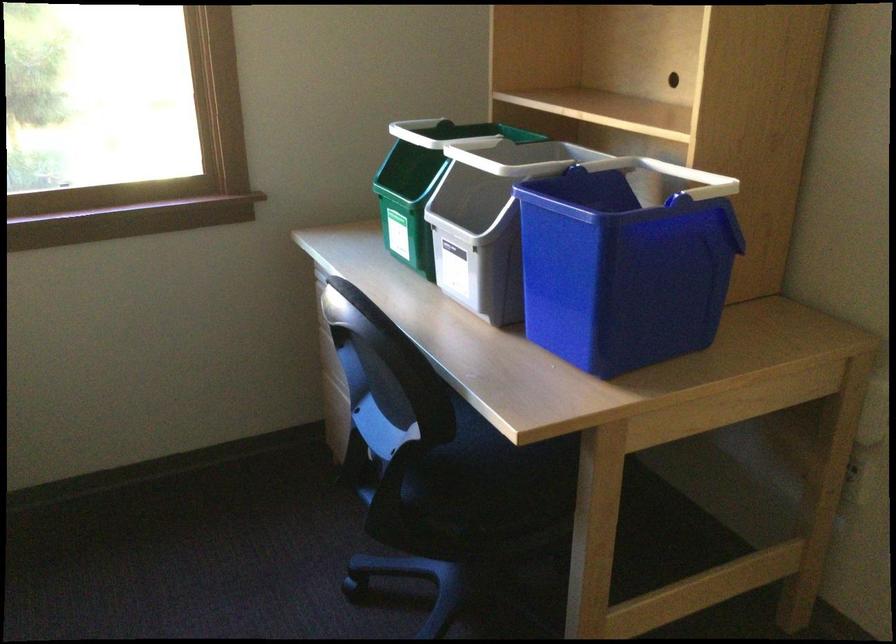
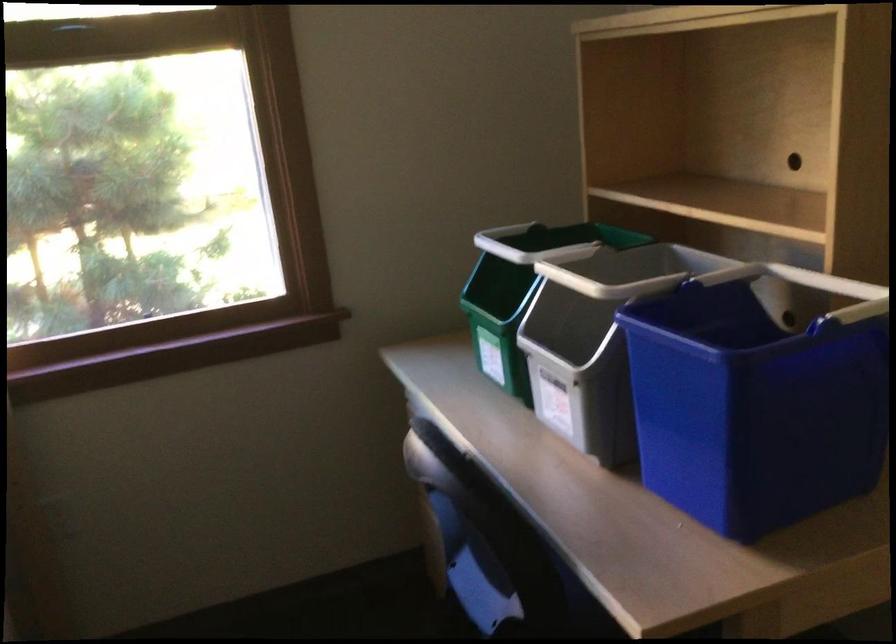
Where in the second image is the point corresponding to pixel 390 377 from the first image?

(483, 541)